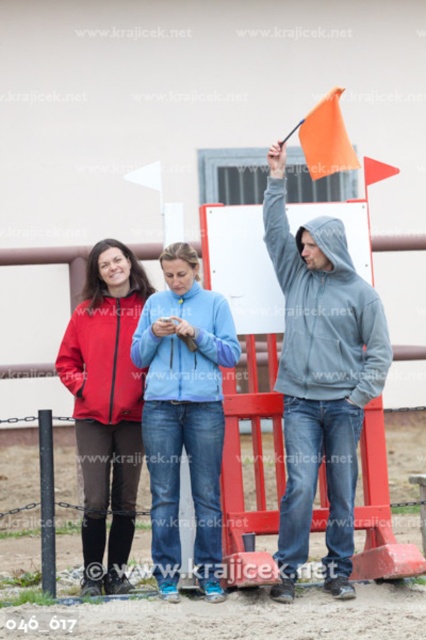
In the scene shown: Does gray hoodie at center have a lesser width compared to matte red sweatshirt at center?

In fact, gray hoodie at center might be wider than matte red sweatshirt at center.

Who is more distant from viewer, (294, 474) or (83, 358)?

The point (83, 358) is more distant.

Is point (301, 356) behind point (129, 365)?

No, it is not.

Find the location of a particular element. Image resolution: width=426 pixels, height=640 pixels. gray hoodie at center is located at coordinates (321, 380).

Which is more to the right, gray fleece hoodie at center or orange fabric flag at upper right?

orange fabric flag at upper right is more to the right.

Is gray fleece hoodie at center taller than orange fabric flag at upper right?

Yes.

The height and width of the screenshot is (640, 426). I want to click on gray fleece hoodie at center, so click(x=325, y=312).

Between gray hoodie at center and light blue fleece jacket at center, which one appears on the right side from the viewer's perspective?

Positioned to the right is gray hoodie at center.

This screenshot has height=640, width=426. What do you see at coordinates (321, 380) in the screenshot?
I see `gray hoodie at center` at bounding box center [321, 380].

Where is `gray hoodie at center`? The image size is (426, 640). gray hoodie at center is located at coordinates (321, 380).